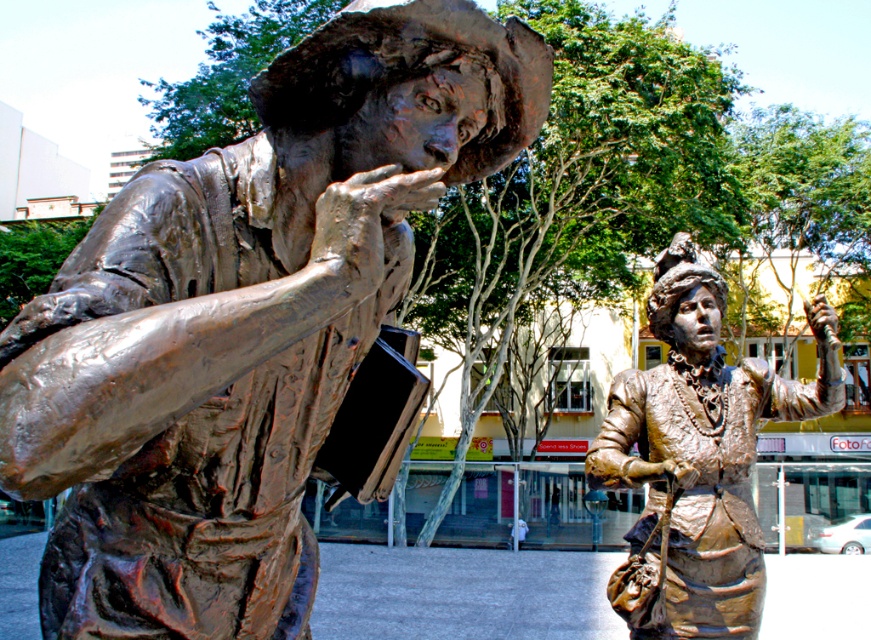
You are an art student who wants to create a scale model of both the bronze statue at left and the bronze statue at right. If the smaller statue is 1.5 meters tall, what should be the height of the larger statue to maintain the same proportions?

Since the bronze statue at left is bigger than the bronze statue at right, the larger statue should be scaled up from the smaller one. If the smaller statue is 1.5 meters tall, the larger statue must be taller than 1.5 meters to maintain proportions.

You are an art curator planning to move both statues into an indoor gallery. The gallery has a narrow corridor that can only accommodate statues narrower than 1.2 meters. Given the bronze statue at left and bronze statue at right, which one might need to be adjusted or resized to fit through the corridor?

The bronze statue at left has a larger width than the bronze statue at right. Since the corridor can only accommodate statues narrower than 1.2 meters, the bronze statue at left might need to be adjusted or resized to fit through the corridor if its width exceeds 1.2 meters.

You are standing at the center of the plaza and want to find the bronze statue at left. Which direction should you look to locate it?

You should look to the left to find the bronze statue at left since it is positioned at point (244,321) relative to your position at the center.